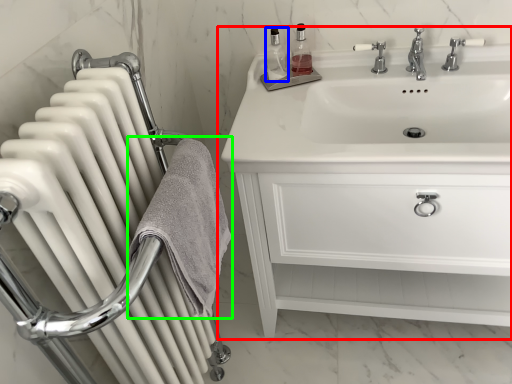
Question: Which object is the farthest from bathroom cabinet (highlighted by a red box)? Choose among these: toiletry (highlighted by a blue box) or bath towel (highlighted by a green box).

Choices:
 (A) toiletry
 (B) bath towel

Answer: (A)